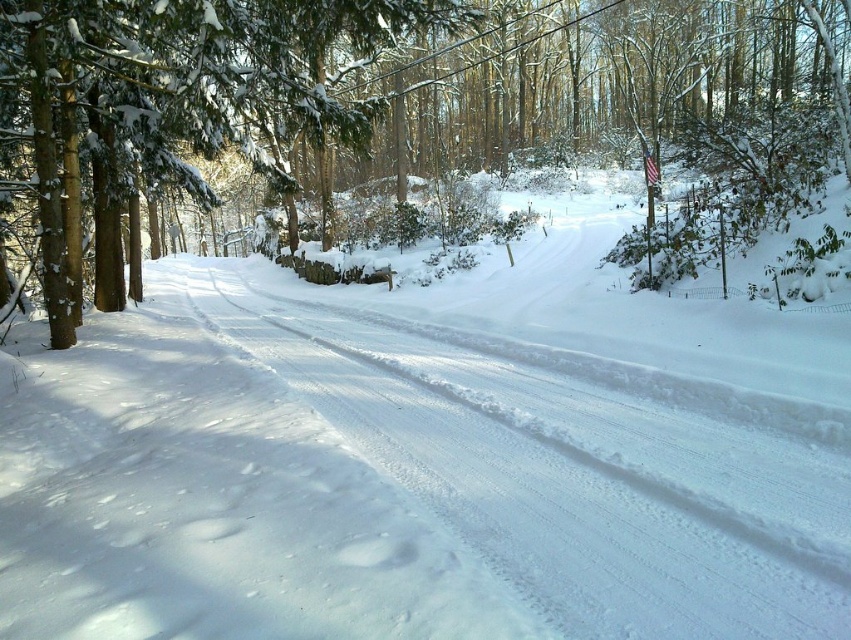
Question: Does white snow trail at center appear under snow-covered evergreen tree at left?

Choices:
 (A) no
 (B) yes

Answer: (B)

Question: Among these points, which one is farthest from the camera?

Choices:
 (A) (246, 10)
 (B) (701, 481)

Answer: (A)

Question: Is white snow trail at center below snow-covered evergreen tree at left?

Choices:
 (A) yes
 (B) no

Answer: (A)

Question: Observing the image, what is the correct spatial positioning of white snow trail at center in reference to snow-covered evergreen tree at left?

Choices:
 (A) below
 (B) above

Answer: (A)

Question: Which object is farther from the camera taking this photo?

Choices:
 (A) white snow trail at center
 (B) snow-covered evergreen tree at left

Answer: (B)

Question: Which of the following is the closest to the observer?

Choices:
 (A) white snow trail at center
 (B) snow-covered evergreen tree at left

Answer: (A)